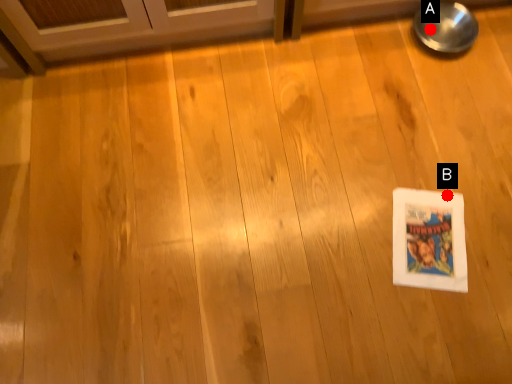
Question: Two points are circled on the image, labeled by A and B beside each circle. Among these points, which one is nearest to the camera?

Choices:
 (A) A is closer
 (B) B is closer

Answer: (B)